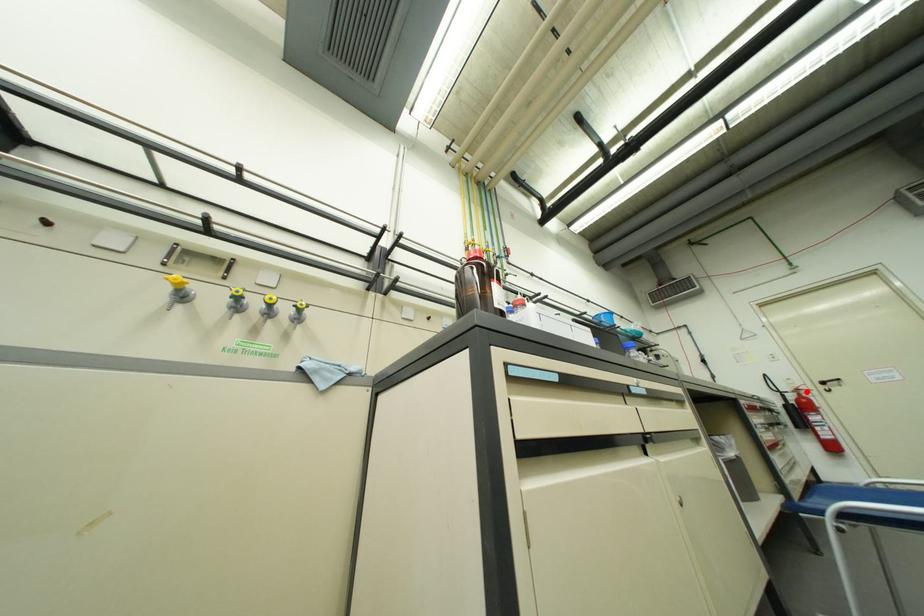
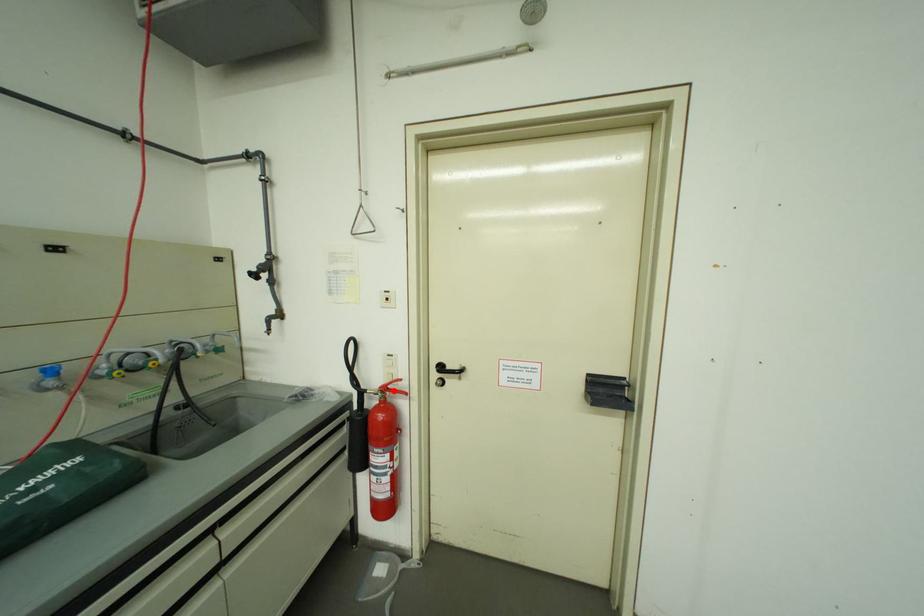
I am providing you with two images of the same scene from different viewpoints. A red point is marked on the first image and another point is marked on the second image. Is the marked point in image1 the same physical position as the marked point in image2?

Yes